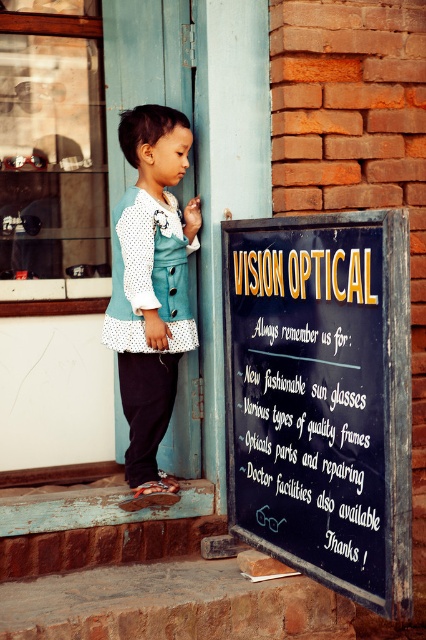
Is black chalkboard at center below white dotted fabric dress at center?

Indeed, black chalkboard at center is positioned under white dotted fabric dress at center.

Is black chalkboard at center further to the viewer compared to white dotted fabric dress at center?

No, it is in front of white dotted fabric dress at center.

Between point (256, 460) and point (118, 317), which one is positioned behind?

The point (118, 317) is more distant.

This screenshot has height=640, width=426. I want to click on black chalkboard at center, so click(x=322, y=397).

Can you confirm if white chalkboard at center is taller than white dotted fabric dress at center?

Incorrect, white chalkboard at center's height is not larger of white dotted fabric dress at center's.

Does point (238, 435) lie behind point (138, 205)?

Yes, point (238, 435) is farther from viewer.

Who is more distant from viewer, (245, 444) or (164, 333)?

Positioned behind is point (164, 333).

You are a GUI agent. You are given a task and a screenshot of the screen. Output one action in this format:
    pyautogui.click(x=<x>, y=<y>)
    Task: Click on the white chalkboard at center
    
    Given the screenshot: What is the action you would take?
    pyautogui.click(x=311, y=433)

Is black chalkboard at center smaller than white chalkboard at center?

Incorrect, black chalkboard at center is not smaller in size than white chalkboard at center.

Identify the location of black chalkboard at center. (322, 397).

Which is in front, point (287, 516) or point (282, 493)?

Point (287, 516)

Find the location of a particular element. This screenshot has width=426, height=640. black chalkboard at center is located at coordinates (322, 397).